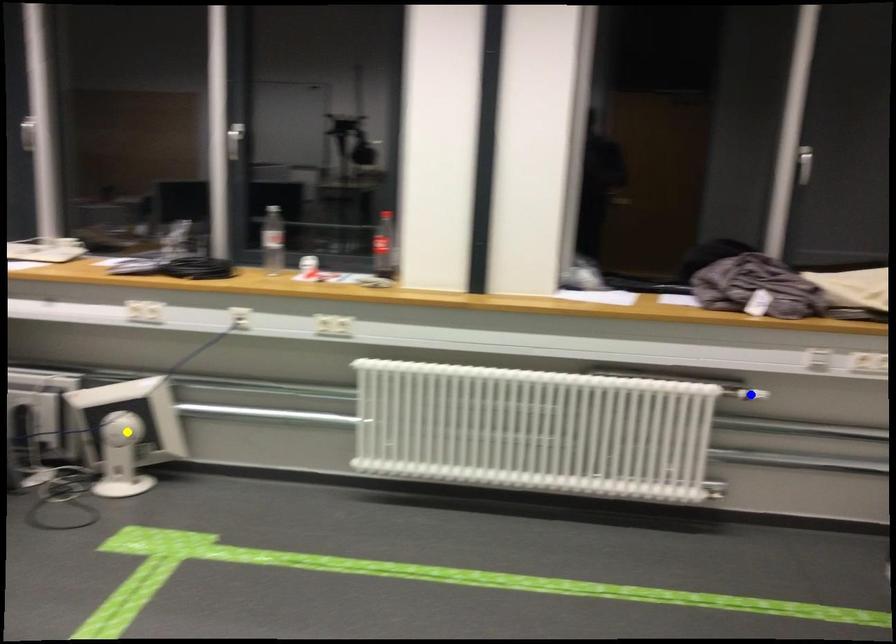
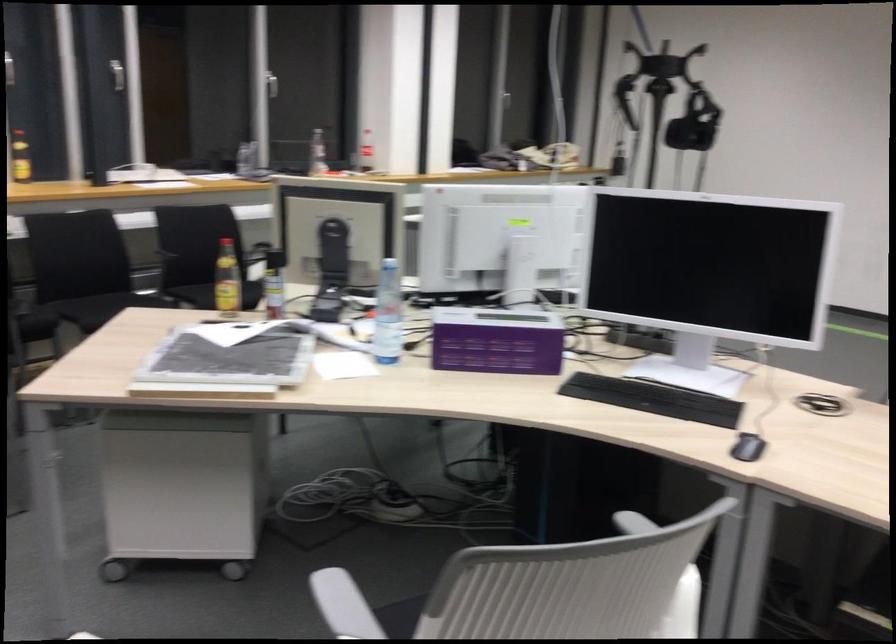
I am providing you with two images of the same scene from different viewpoints. Three points are marked in image1. Which point corresponds to a part or object that is occluded in image2?In image1, three points are marked. Which of them correspond to a part or object that is occluded in image2?Among the three points shown in image1, which one corresponds to a part or object that is no longer visible due to occlusion in image2?

green point, blue point, yellow point